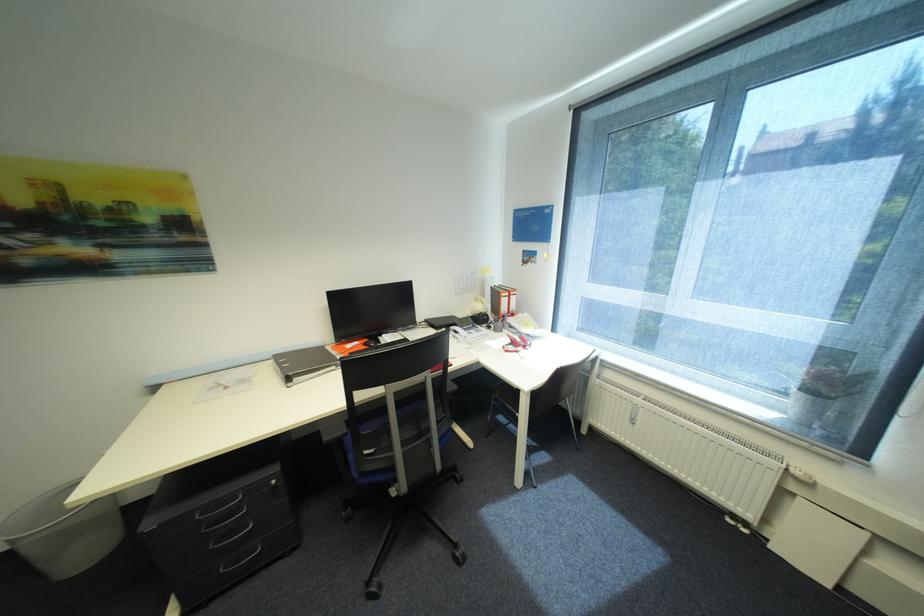
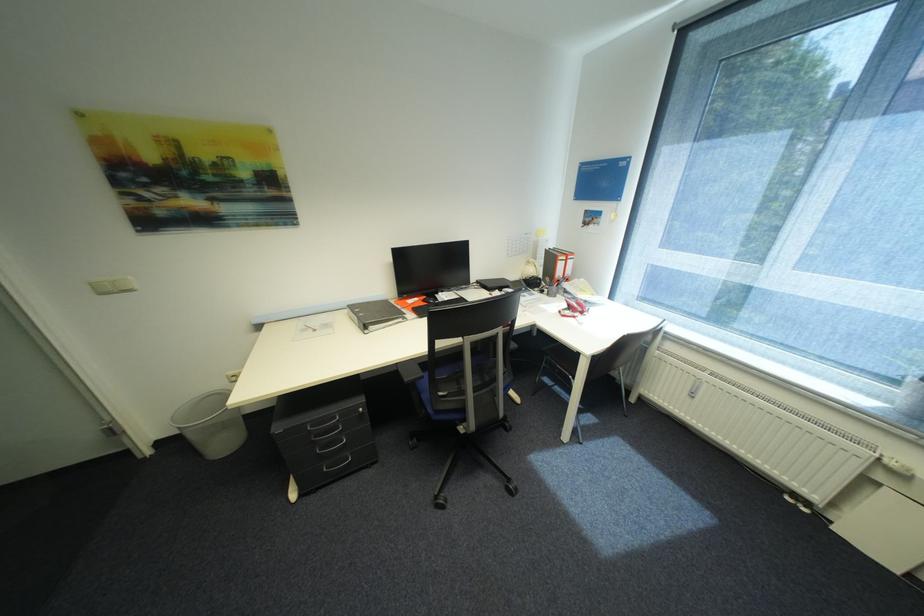
Question: Based on the continuous images, in which direction is the camera rotating? Reply with the corresponding letter.

Choices:
 (A) Left
 (B) Right
 (C) Up
 (D) Down

Answer: (D)